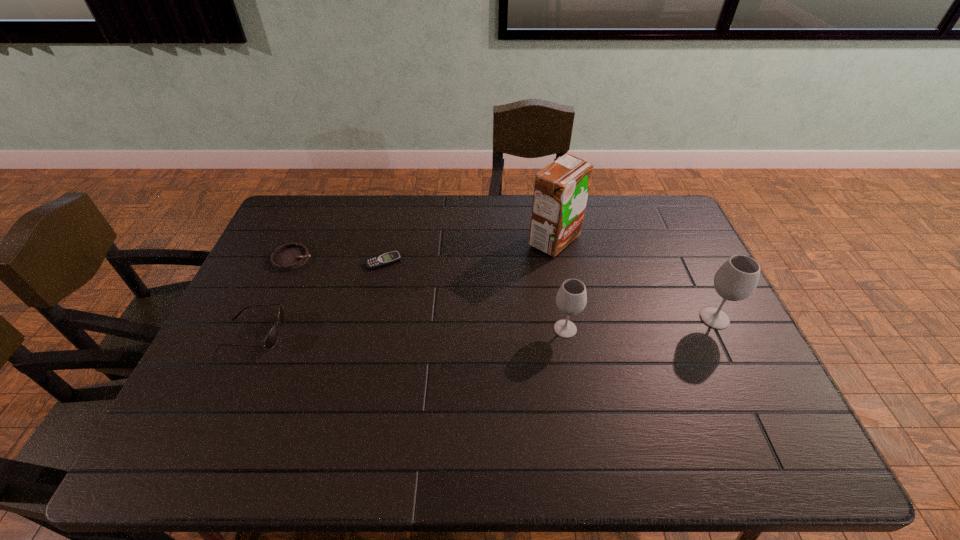
Locate an element on the screen. vacant position in the image that satisfies the following two spatial constraints: 1. on the front side of the fourth shortest object; 2. on the right side of the third object from left to right is located at coordinates (369, 329).

Identify the location of vacant space that satisfies the following two spatial constraints: 1. on the straw side of the tallest object; 2. on the left side of the fifth shortest object. (568, 319).

At what (x,y) coordinates should I click in order to perform the action: click on vacant region that satisfies the following two spatial constraints: 1. on the straw side of the carton; 2. on the front side of the third tallest object. Please return your answer as a coordinate pair (x, y). The image size is (960, 540). Looking at the image, I should click on (570, 329).